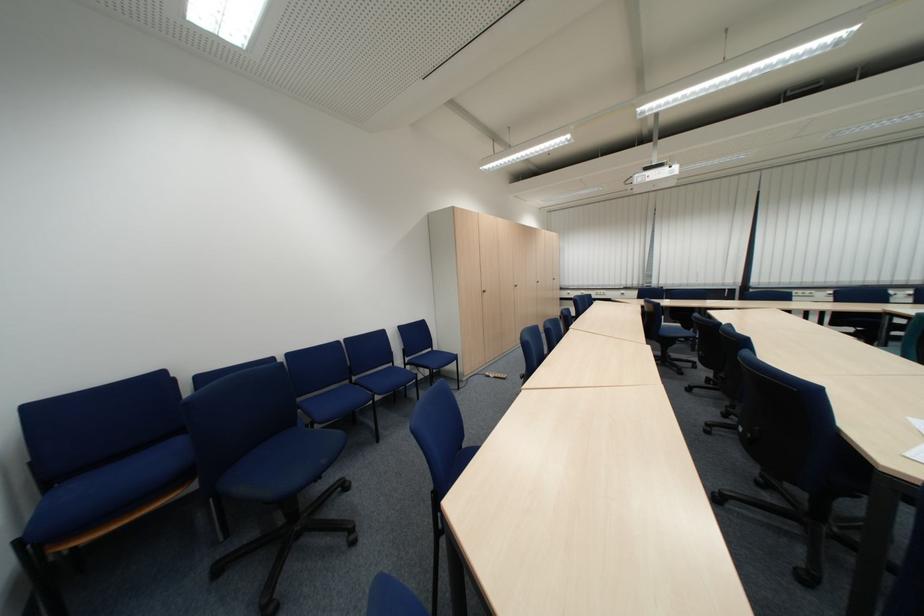
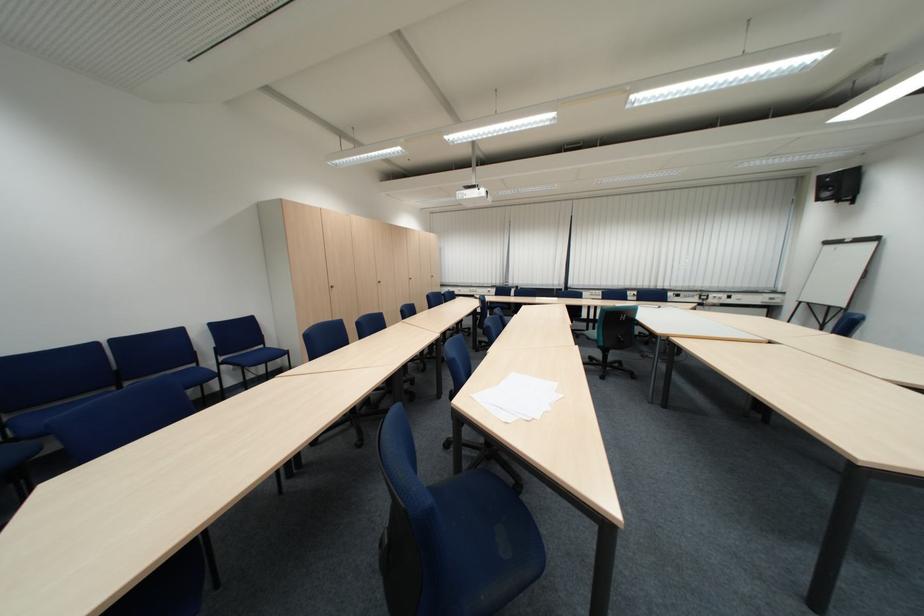
In the second image, find the point that corresponds to the point at 732,283 in the first image.

(564, 284)